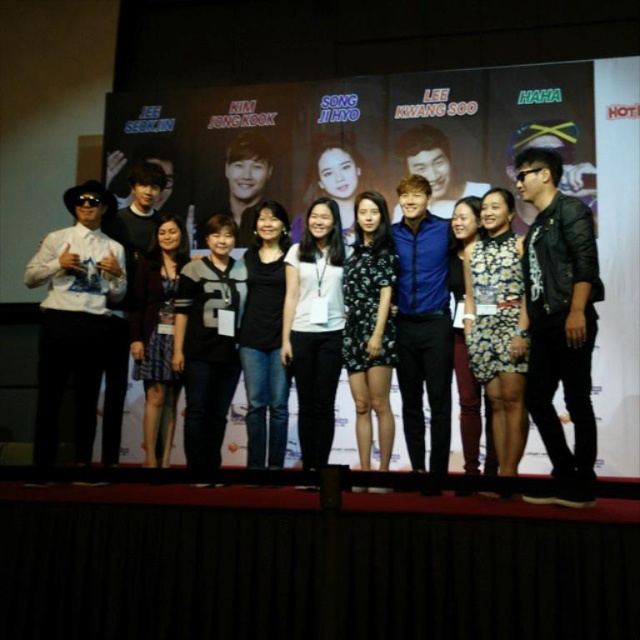
Is point (404, 371) positioned after point (349, 326)?

No, (404, 371) is in front of (349, 326).

Between black leather jacket at center and floral-patterned dress at center, which one is positioned higher?

black leather jacket at center is higher up.

Where is `black leather jacket at center`? This screenshot has width=640, height=640. black leather jacket at center is located at coordinates (534, 316).

I want to click on black leather jacket at center, so click(x=534, y=316).

Can you confirm if leather jacket at right is smaller than floral dress at center?

Incorrect, leather jacket at right is not smaller in size than floral dress at center.

Based on the photo, which of these two, leather jacket at right or floral dress at center, stands shorter?

With less height is floral dress at center.

Locate an element on the screen. leather jacket at right is located at coordinates (560, 310).

This screenshot has width=640, height=640. What are the coordinates of `floral-patterned dress at center` in the screenshot? It's located at pyautogui.click(x=369, y=324).

Is floral-patterned dress at center to the left of plaid skirt at center from the viewer's perspective?

In fact, floral-patterned dress at center is to the right of plaid skirt at center.

Is point (380, 428) behind point (140, 365)?

No, (380, 428) is in front of (140, 365).

Identify the location of floral-patterned dress at center. This screenshot has width=640, height=640. (369, 324).